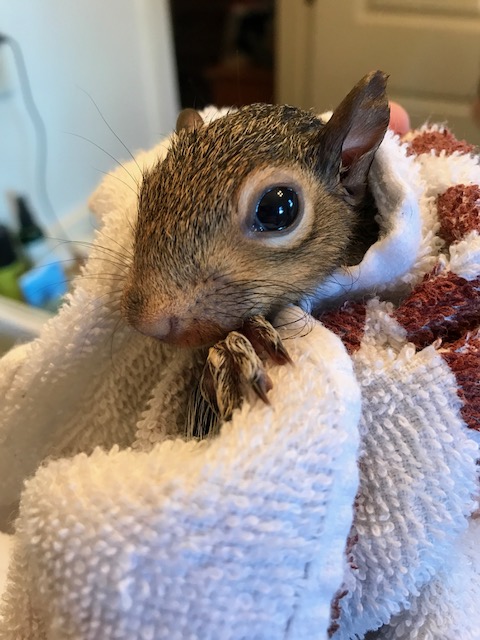
Where is `bottle`? bottle is located at coordinates (29, 236).